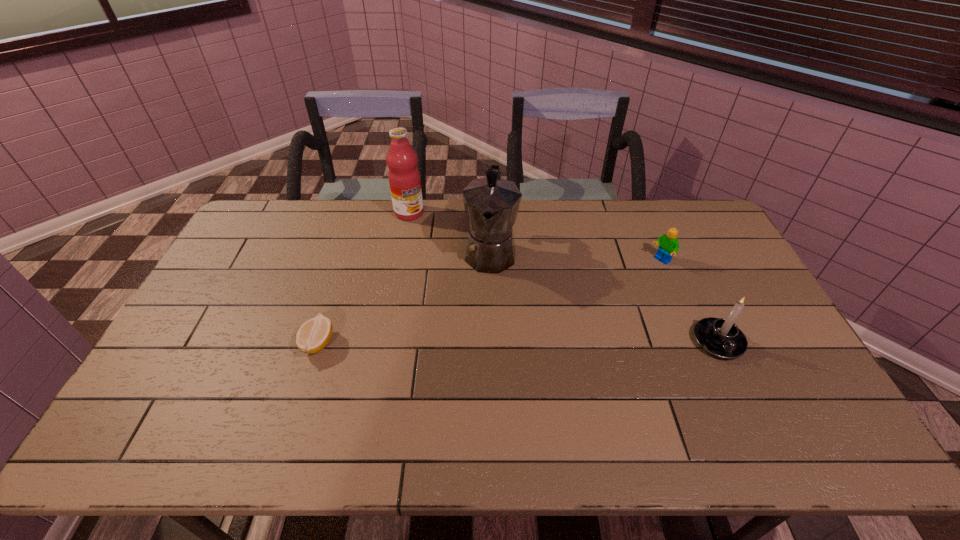
The image size is (960, 540). I want to click on vacant space located 0.270m on the pouring side of the third object from left to right, so (x=479, y=352).

At what (x,y) coordinates should I click in order to perform the action: click on vacant space located 0.340m on the pouring side of the third object from left to right. Please return your answer as a coordinate pair (x, y). Looking at the image, I should click on (476, 374).

The height and width of the screenshot is (540, 960). I want to click on free space located on the face of the second shortest object, so click(x=597, y=308).

Identify the location of blank space located 0.120m on the face of the second shortest object. (632, 283).

At what (x,y) coordinates should I click in order to perform the action: click on free space located 0.260m on the face of the second shortest object. Please return your answer as a coordinate pair (x, y). The height and width of the screenshot is (540, 960). Looking at the image, I should click on (604, 303).

Where is `free space located 0.060m on the label of the farthest object`? free space located 0.060m on the label of the farthest object is located at coordinates (x=420, y=230).

Find the location of a particular element. The width and height of the screenshot is (960, 540). free space located 0.240m on the label of the farthest object is located at coordinates (442, 260).

Find the location of a particular element. Image resolution: width=960 pixels, height=540 pixels. vacant region located on the label of the farthest object is located at coordinates (462, 288).

The height and width of the screenshot is (540, 960). Find the location of `coffeepot present at the far edge`. coffeepot present at the far edge is located at coordinates (491, 204).

Identify the location of fruit juice that is positioned at the far edge. The image size is (960, 540). (404, 178).